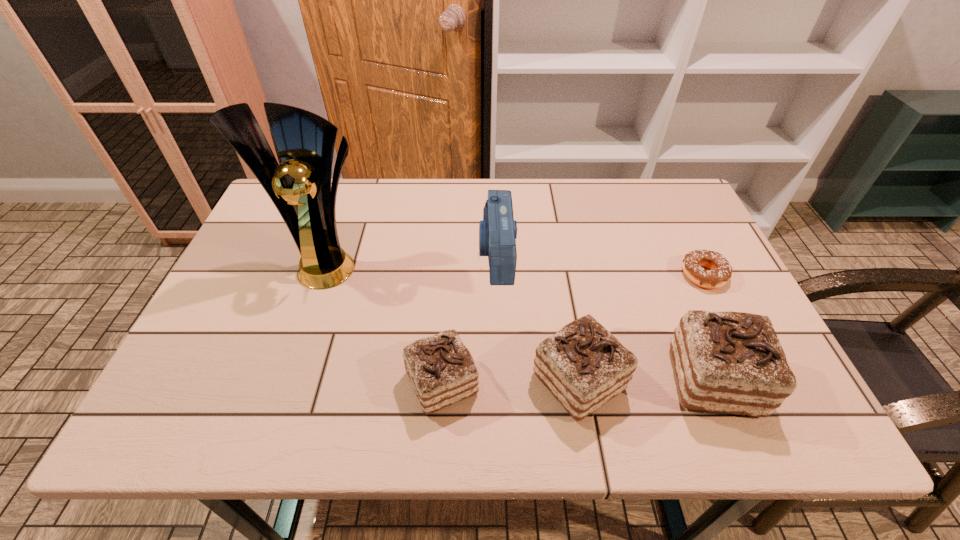
Find the location of `vacant space that satisfies the following two spatial constraints: 1. on the back side of the rightmost chocolate cake; 2. on the right side of the leftmost chocolate cake`. vacant space that satisfies the following two spatial constraints: 1. on the back side of the rightmost chocolate cake; 2. on the right side of the leftmost chocolate cake is located at coordinates (443, 380).

Identify the location of blank space that satisfies the following two spatial constraints: 1. at the front of the leftmost chocolate cake, where the globe is visible; 2. on the right side of the leftmost object. The height and width of the screenshot is (540, 960). (286, 383).

You are a GUI agent. You are given a task and a screenshot of the screen. Output one action in this format:
    pyautogui.click(x=<x>, y=<y>)
    Task: Click on the free spot that satisfies the following two spatial constraints: 1. on the back side of the doughnut; 2. on the right side of the second chocolate cake from right to left
    
    Given the screenshot: What is the action you would take?
    pyautogui.click(x=560, y=275)

You are a GUI agent. You are given a task and a screenshot of the screen. Output one action in this format:
    pyautogui.click(x=<x>, y=<y>)
    Task: Click on the vacant region that satisfies the following two spatial constraints: 1. at the front of the leftmost object, where the globe is visible; 2. on the right side of the leftmost chocolate cake
    This screenshot has width=960, height=540.
    Given the screenshot: What is the action you would take?
    point(286,383)

You are a GUI agent. You are given a task and a screenshot of the screen. Output one action in this format:
    pyautogui.click(x=<x>, y=<y>)
    Task: Click on the vacant region that satisfies the following two spatial constraints: 1. on the lens of the camera; 2. on the back side of the third object from right to left
    Image resolution: width=960 pixels, height=540 pixels.
    Given the screenshot: What is the action you would take?
    pyautogui.click(x=501, y=381)

Identify the location of free region that satisfies the following two spatial constraints: 1. at the front of the tallest object, where the globe is visible; 2. on the right side of the shortest object. (323, 275).

Identify the location of vacant region that satisfies the following two spatial constraints: 1. on the lens of the camera; 2. on the right side of the rightmost chocolate cake. (501, 380).

At what (x,y) coordinates should I click in order to perform the action: click on free region that satisfies the following two spatial constraints: 1. on the lens of the camera; 2. at the front of the award, where the globe is visible. Please return your answer as a coordinate pair (x, y). Looking at the image, I should click on (496, 261).